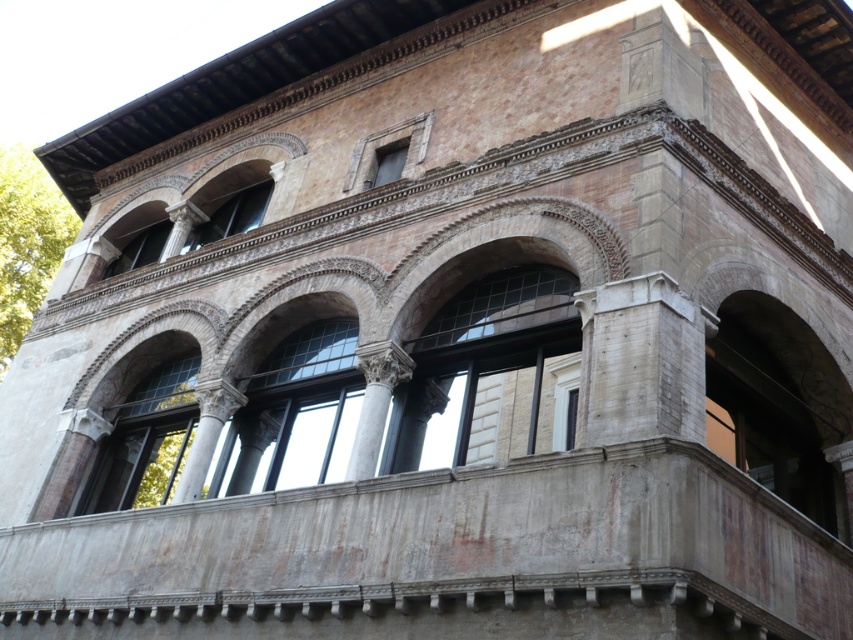
From the picture: Who is positioned more to the right, clear glass window at center or matte glass window at upper left?

From the viewer's perspective, clear glass window at center appears more on the right side.

Who is shorter, clear glass window at center or matte glass window at upper left?

matte glass window at upper left

You are a GUI agent. You are given a task and a screenshot of the screen. Output one action in this format:
    pyautogui.click(x=<x>, y=<y>)
    Task: Click on the clear glass window at center
    
    Given the screenshot: What is the action you would take?
    pyautogui.click(x=294, y=413)

Locate an element on the screen. The width and height of the screenshot is (853, 640). matte glass window at upper center is located at coordinates (231, 216).

Who is lower down, clear glass window at center or matte glass window at upper center?

Positioned lower is clear glass window at center.

Is clear glass window at center below matte glass window at upper center?

Indeed, clear glass window at center is positioned under matte glass window at upper center.

Locate an element on the screen. This screenshot has height=640, width=853. clear glass window at center is located at coordinates (294, 413).

Where is `clear glass window at center`? This screenshot has height=640, width=853. clear glass window at center is located at coordinates (294, 413).